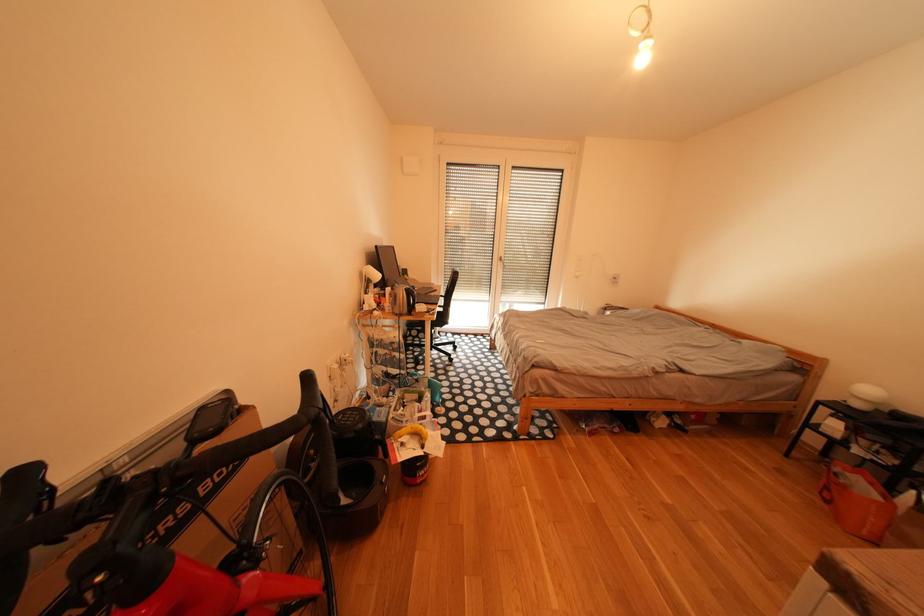
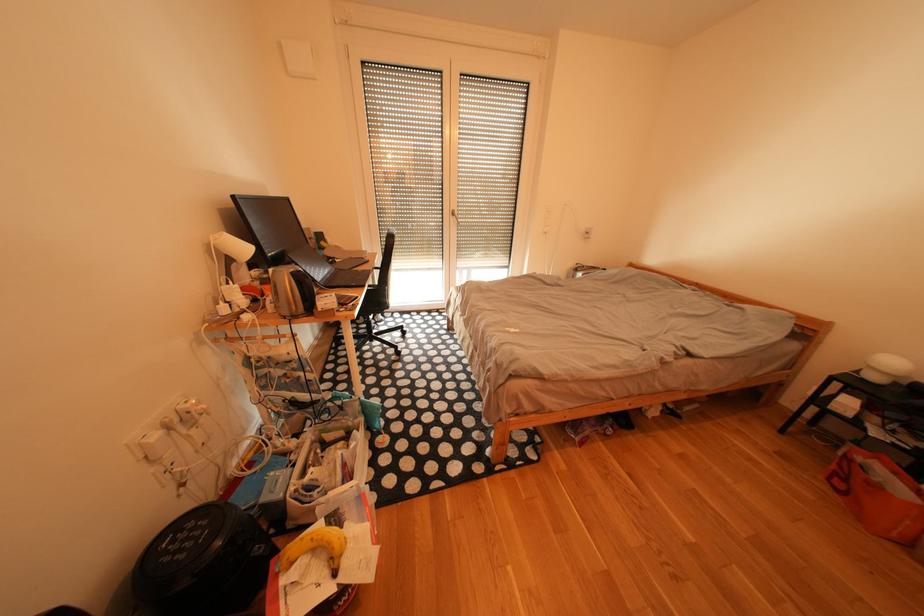
The images are taken continuously from a first-person perspective. In which direction are you moving?

The cameraman walked toward right, forward.